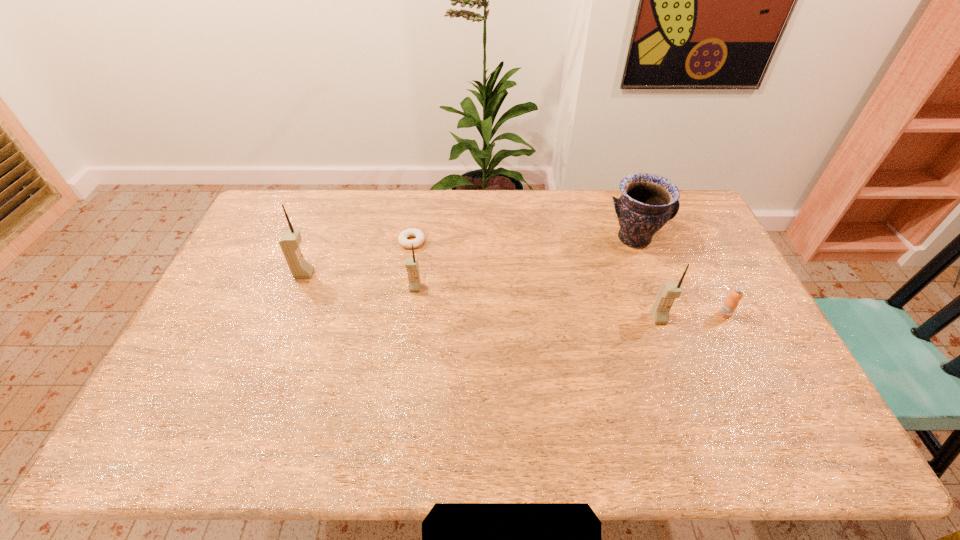
Find the location of `free space at the left edge`. free space at the left edge is located at coordinates [220, 288].

Locate an element on the screen. vacant space at the right edge of the desktop is located at coordinates (702, 299).

The height and width of the screenshot is (540, 960). What are the coordinates of `unoccupied area between the second shortest object and the pottery` in the screenshot? It's located at (680, 276).

This screenshot has height=540, width=960. I want to click on vacant space that is in between the fifth tallest object and the leftmost object, so click(515, 294).

I want to click on blank region between the fifth tallest object and the leftmost cellular telephone, so click(x=515, y=294).

The height and width of the screenshot is (540, 960). Identify the location of empty space between the third farthest object and the pottery. (469, 256).

Locate an element on the screen. This screenshot has height=540, width=960. vacant space that is in between the orange juice and the rightmost cellular telephone is located at coordinates (692, 316).

Find the location of a particular element. Image resolution: width=960 pixels, height=540 pixels. vacant area that lies between the nearest cellular telephone and the third nearest object is located at coordinates (537, 303).

Identify the location of free area in between the third farthest object and the rightmost cellular telephone. The height and width of the screenshot is (540, 960). (482, 296).

The height and width of the screenshot is (540, 960). In order to click on free spot between the farthest cellular telephone and the second shortest cellular telephone in this screenshot , I will do `click(482, 296)`.